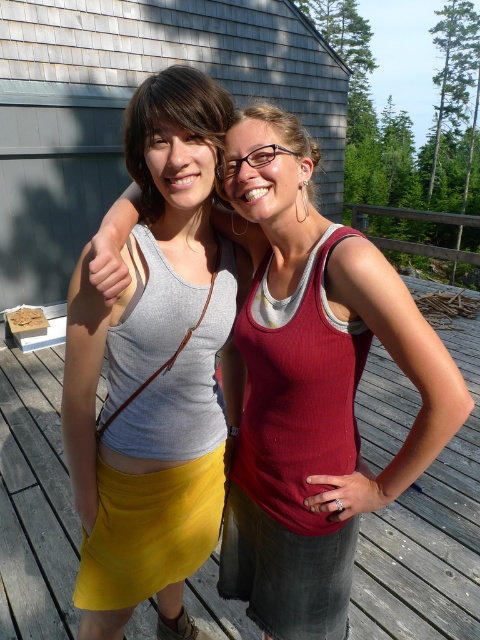
Describe the element at coordinates (154, 362) in the screenshot. I see `gray matte tank top at center` at that location.

Is gray matte tank top at center wider than yellow fabric skirt at center?

No, gray matte tank top at center is not wider than yellow fabric skirt at center.

Does point (62, 406) come farther from viewer compared to point (130, 634)?

That is False.

At what (x,y) coordinates should I click in order to perform the action: click on gray matte tank top at center. Please return your answer as a coordinate pair (x, y). Image resolution: width=480 pixels, height=640 pixels. Looking at the image, I should click on (154, 362).

In order to click on gray matte tank top at center in this screenshot , I will do `click(154, 362)`.

Between gray matte tank top at center and matte gray tank top at center, which one is positioned higher?

matte gray tank top at center is above.

Is point (116, 365) farther from camera compared to point (163, 116)?

Yes, it is.

At what (x,y) coordinates should I click in order to perform the action: click on gray matte tank top at center. Please return your answer as a coordinate pair (x, y). Looking at the image, I should click on 154,362.

Is yellow fabric skirt at center further to camera compared to matte gray tank top at center?

Yes, it is.

Is the position of yellow fabric skirt at center less distant than that of matte gray tank top at center?

No, yellow fabric skirt at center is behind matte gray tank top at center.

Locate an element on the screen. This screenshot has height=640, width=480. yellow fabric skirt at center is located at coordinates (428, 536).